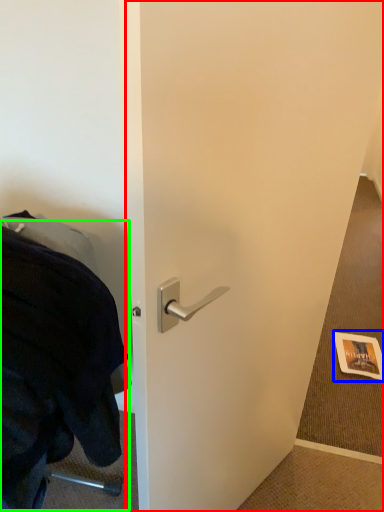
Question: Which is nearer to the door (highlighted by a red box)? postcard (highlighted by a blue box) or blanket (highlighted by a green box).

Choices:
 (A) postcard
 (B) blanket

Answer: (B)